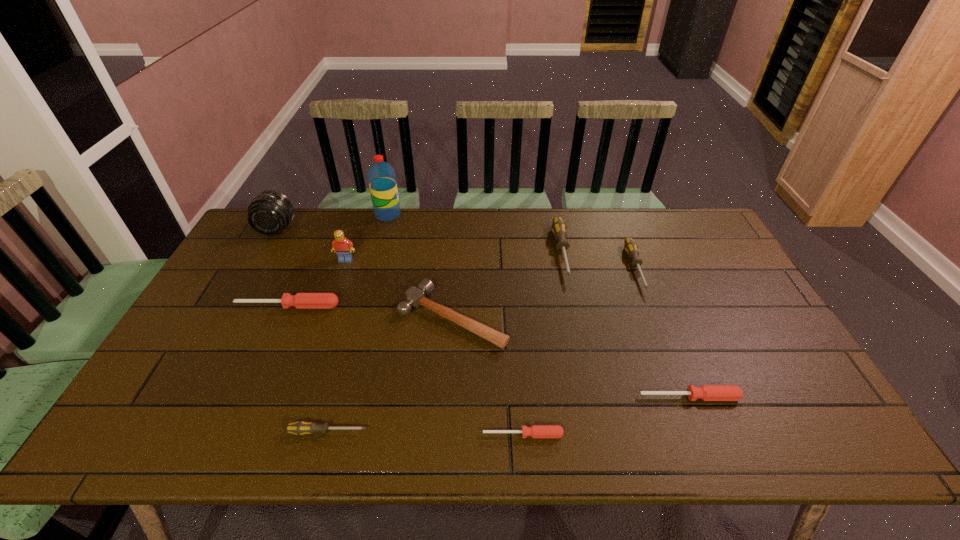
Image resolution: width=960 pixels, height=540 pixels. I want to click on gray screwdriver that is the third closest one to the Lego, so click(x=630, y=246).

You are a GUI agent. You are given a task and a screenshot of the screen. Output one action in this format:
    pyautogui.click(x=<x>, y=<y>)
    Task: Click on the third closest gray screwdriver to the red water bottle
    The height and width of the screenshot is (540, 960).
    Given the screenshot: What is the action you would take?
    pyautogui.click(x=299, y=428)

You are a GUI agent. You are given a task and a screenshot of the screen. Output one action in this format:
    pyautogui.click(x=<x>, y=<y>)
    Task: Click on the red screwdriver that is the second closest to the farthest red screwdriver
    The width and height of the screenshot is (960, 540).
    Given the screenshot: What is the action you would take?
    pyautogui.click(x=706, y=392)

Locate an element on the screen. This screenshot has height=540, width=960. the second closest red screwdriver to the telephoto lens is located at coordinates (535, 431).

Where is `free space that satisfies the following two spatial constraints: 1. at the front element of the telephoto lens; 2. on the right side of the hammer`? This screenshot has height=540, width=960. free space that satisfies the following two spatial constraints: 1. at the front element of the telephoto lens; 2. on the right side of the hammer is located at coordinates (228, 317).

Find the location of a particular element. The height and width of the screenshot is (540, 960). free space that satisfies the following two spatial constraints: 1. at the front element of the rightmost red screwdriver; 2. on the right side of the second tallest object is located at coordinates (183, 397).

The width and height of the screenshot is (960, 540). What are the coordinates of `vacant space that satisfies the following two spatial constraints: 1. at the tip of the fourth screwdriver from left to right; 2. at the tip of the nearest gray screwdriver` in the screenshot? It's located at (600, 431).

In order to click on vacant region that satisfies the following two spatial constraints: 1. on the front side of the hammer; 2. on the right side of the rightmost red screwdriver in this screenshot , I will do `click(447, 397)`.